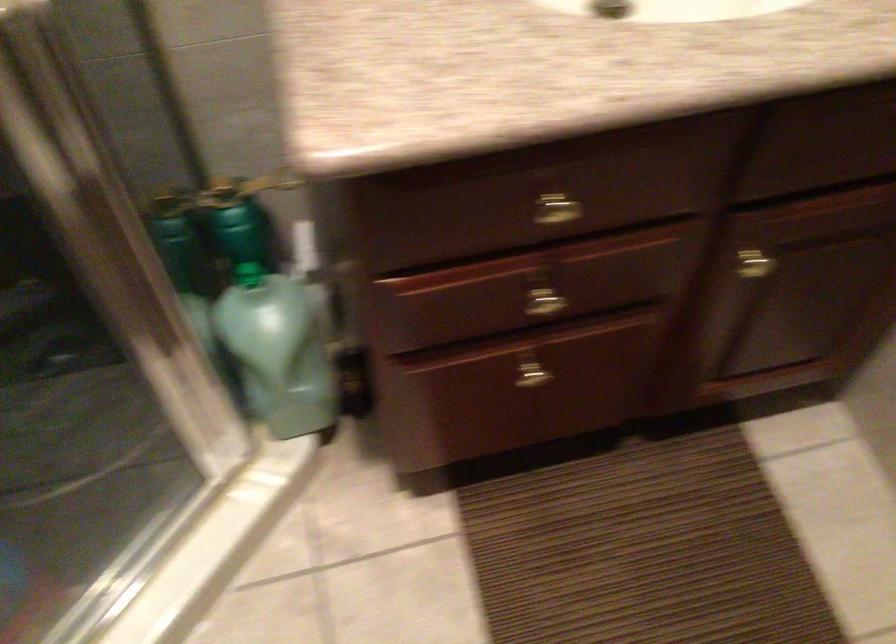
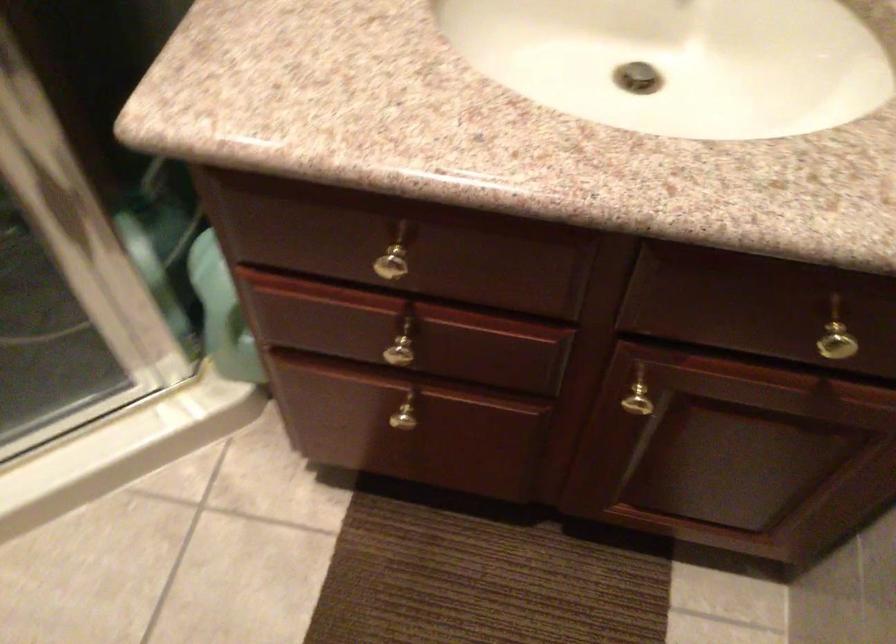
Locate, in the second image, the point that corresponds to point (545, 305) in the first image.

(401, 354)